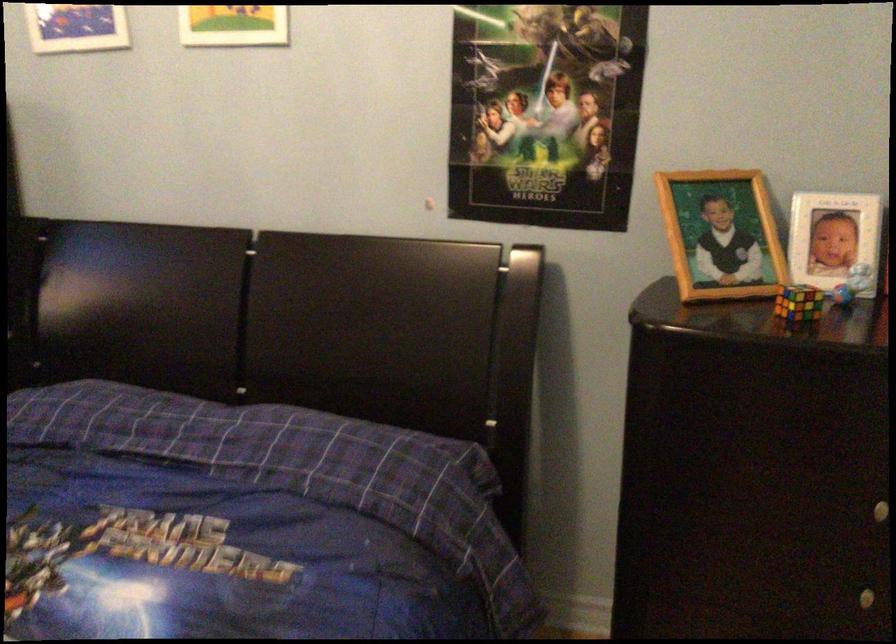
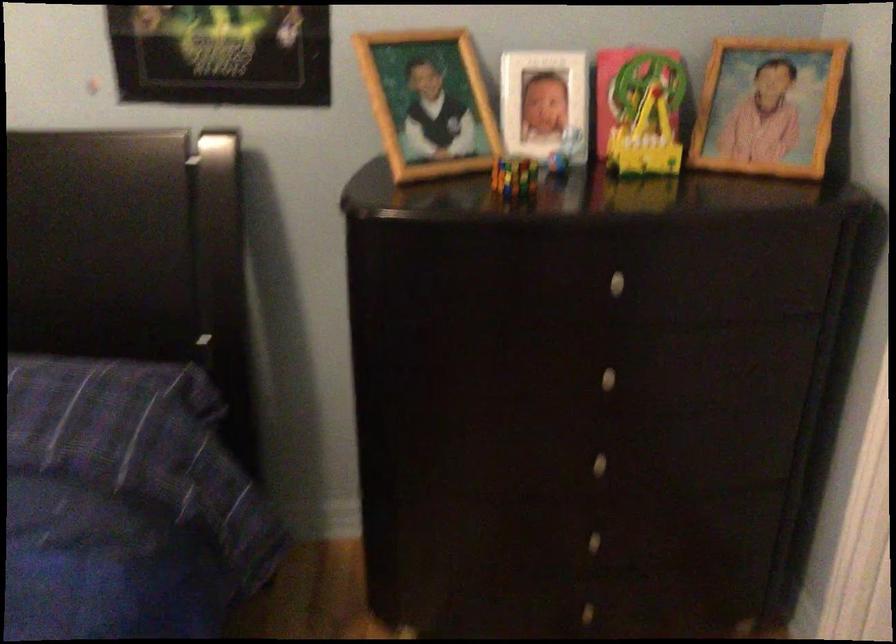
Question: Based on the continuous images, in which direction is the camera rotating? Reply with the corresponding letter.

Choices:
 (A) Left
 (B) Right
 (C) Up
 (D) Down

Answer: (B)